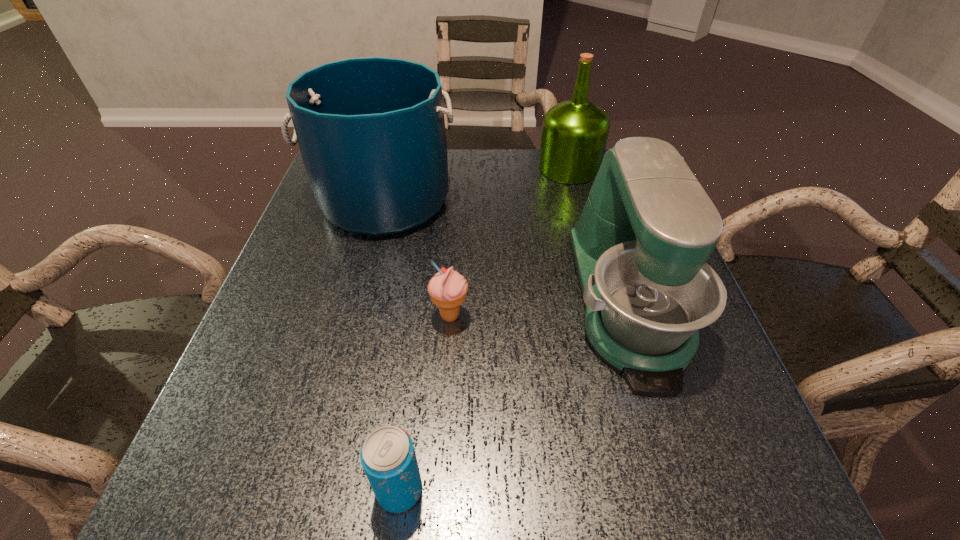
Image resolution: width=960 pixels, height=540 pixels. I want to click on blank region between the olive oil and the icecream, so click(x=510, y=242).

Where is `object that is the closest to the nearest object`? object that is the closest to the nearest object is located at coordinates (447, 289).

Select which object appears as the second closest to the olive oil. Please provide its 2D coordinates. Your answer should be formatted as a tuple, i.e. [(x, y)], where the tuple contains the x and y coordinates of a point satisfying the conditions above.

[(371, 131)]

Find the location of `vacant space that satisfies the following two spatial constraints: 1. on the front side of the icecream; 2. on the right side of the bucket`. vacant space that satisfies the following two spatial constraints: 1. on the front side of the icecream; 2. on the right side of the bucket is located at coordinates (354, 316).